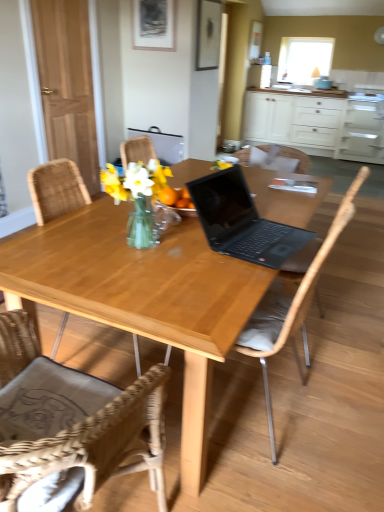
Identify the location of vacant space positioned to the left of translucent glass vase at center. Image resolution: width=384 pixels, height=512 pixels. (80, 238).